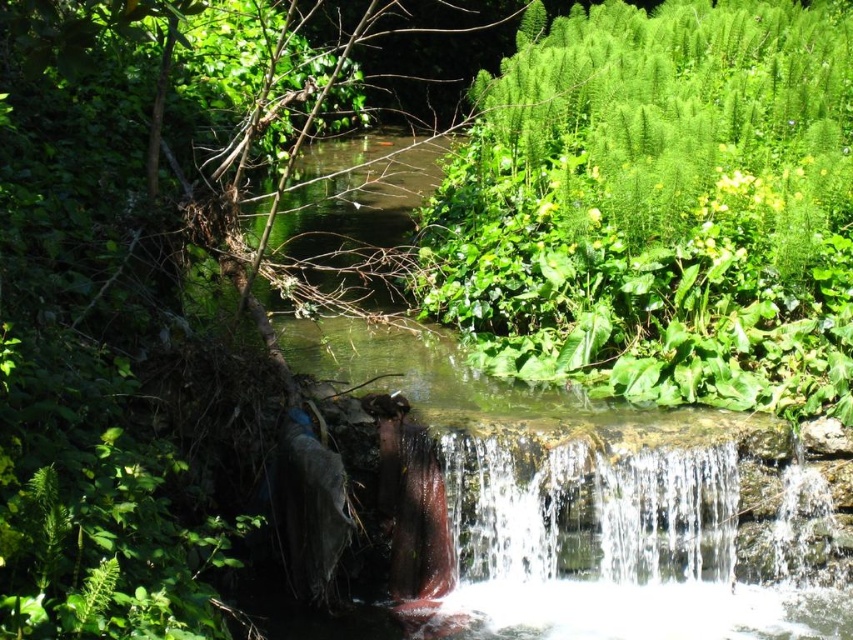
You are a hiker who wants to take a photo of the green leafy plant at upper right and the green mossy rock at center. Which object should you focus on first to ensure both are in the frame?

You should focus on the green mossy rock at center first because it is closer to you than the green leafy plant at upper right, which is further away.

You are planning to cross the stream using a wooden plank that is 1 meter wide. You see the green mossy rock at center and the clear water at center. Which object is wider, and will the plank fit across them?

The green mossy rock at center is wider than the clear water at center. Since the plank is 1 meter wide, it depends on the actual width of the rock and water. However, the description only states the rock is wider than the water, but doesn not provide exact measurements. Therefore, we cannot definitively determine if the plank will fit without knowing the specific widths.